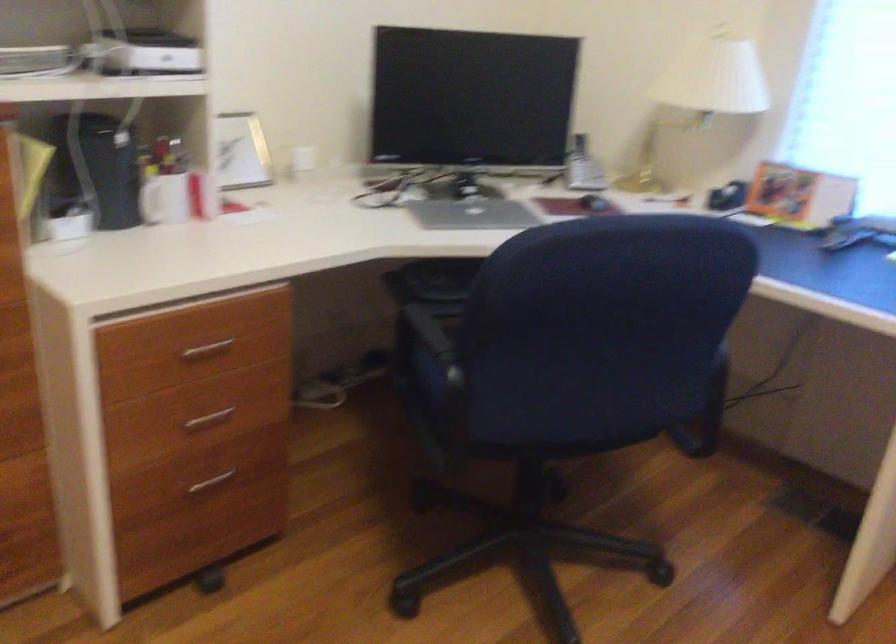
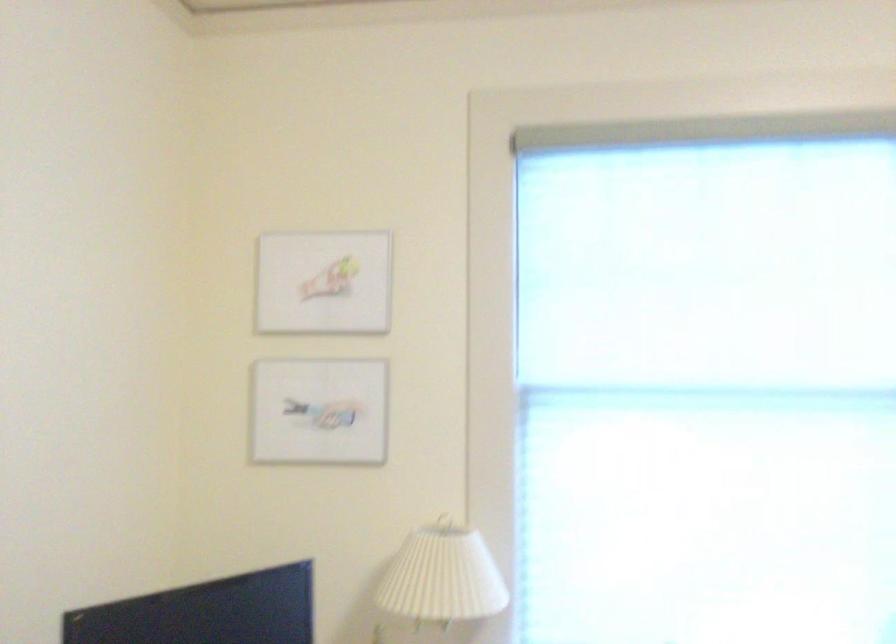
Locate, in the second image, the point that corresponds to point 694,73 in the first image.

(443, 576)